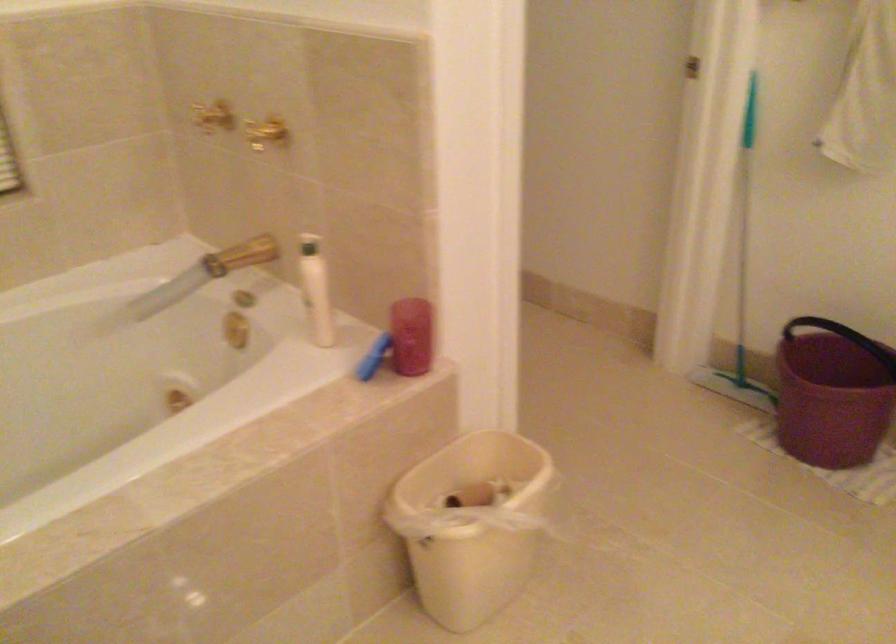
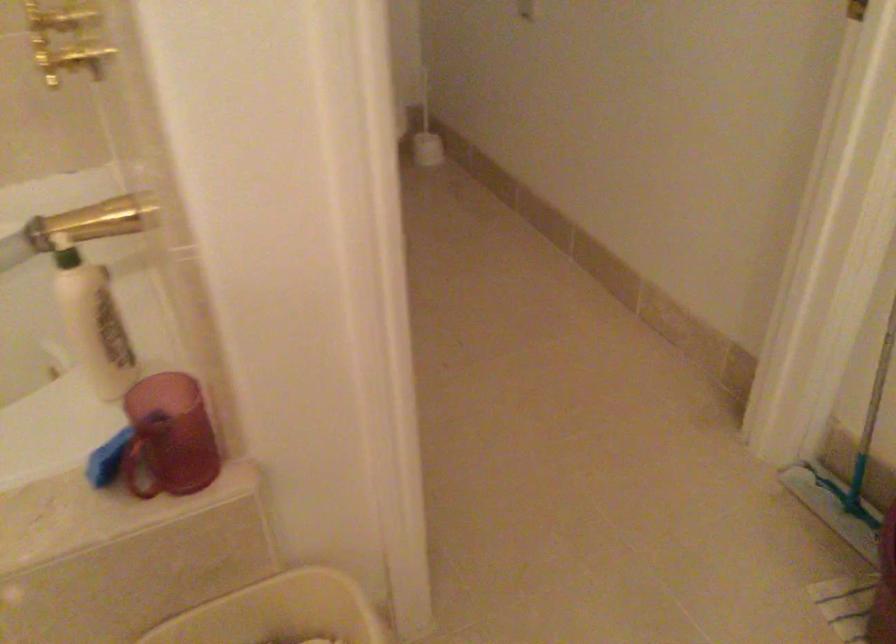
Where in the second image is the point corresponding to the point at 244,252 from the first image?

(95, 222)